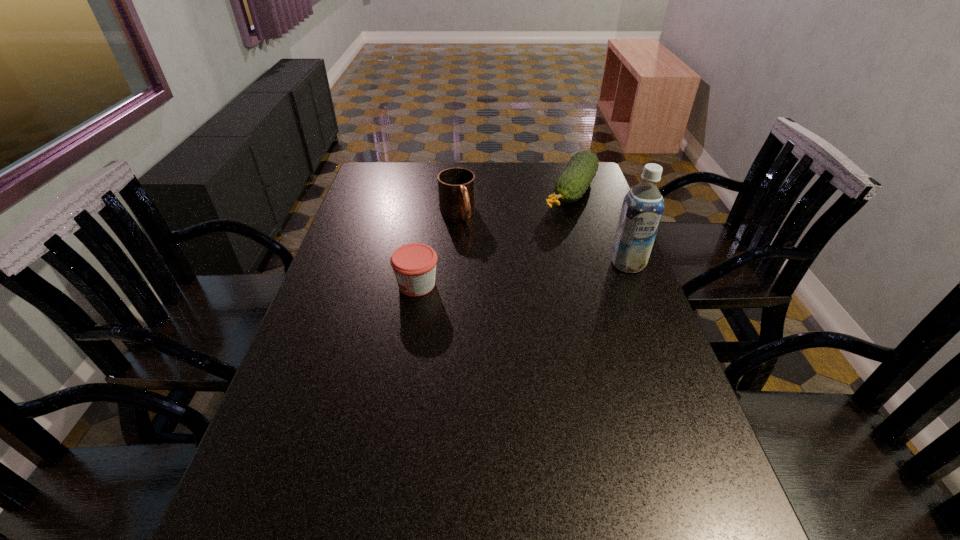
This screenshot has height=540, width=960. I want to click on vacant space at the left edge, so click(376, 298).

Image resolution: width=960 pixels, height=540 pixels. Identify the location of vacant space at the right edge of the desktop. (588, 218).

In order to click on vacant space at the far left corner in this screenshot , I will do `click(368, 182)`.

This screenshot has width=960, height=540. I want to click on vacant space at the near right corner of the desktop, so click(700, 465).

The width and height of the screenshot is (960, 540). Identify the location of vacant area that lies between the mug and the cucumber. (514, 202).

At what (x,y) coordinates should I click in order to perform the action: click on vacant area that lies between the soya milk and the cucumber. Please return your answer as a coordinate pair (x, y). Looking at the image, I should click on (599, 228).

Find the location of a particular element. The height and width of the screenshot is (540, 960). free space between the jam and the tallest object is located at coordinates (522, 274).

Find the location of `empty space between the cucumber and the mug`. empty space between the cucumber and the mug is located at coordinates (514, 202).

I want to click on vacant space that is in between the jam and the mug, so click(x=437, y=249).

You are a GUI agent. You are given a task and a screenshot of the screen. Output one action in this format:
    pyautogui.click(x=<x>, y=<y>)
    Task: Click on the free spot between the cucumber and the jam
    
    Given the screenshot: What is the action you would take?
    pyautogui.click(x=493, y=238)